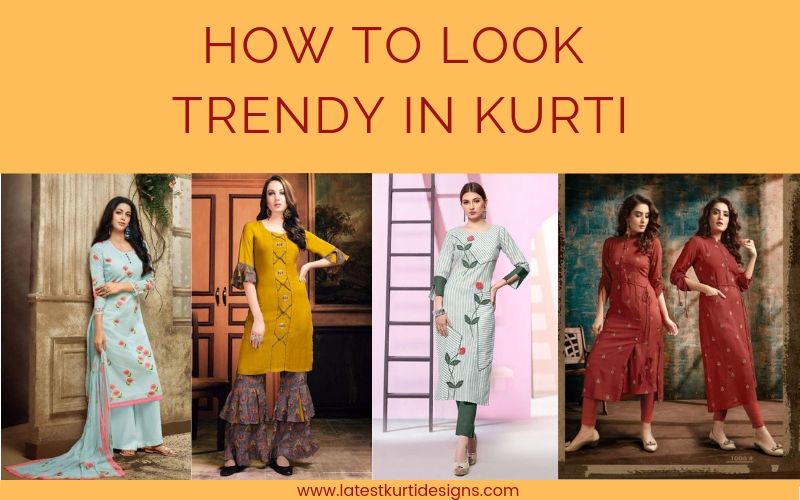
At what (x,y) coordinates should I click in order to perform the action: click on rattan / wooden chair. Please return your answer as a coordinate pair (x, y). Image resolution: width=800 pixels, height=500 pixels. Looking at the image, I should click on (573, 340).